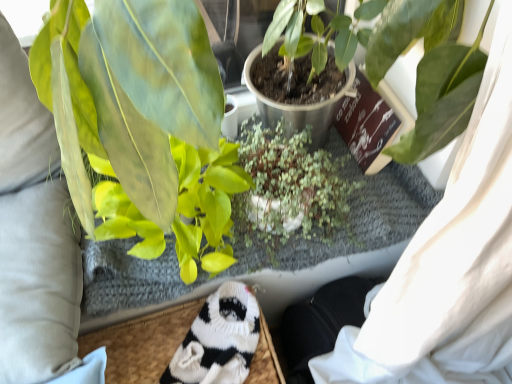
Question: Does green matte leafy plant at left, the second houseplant positioned from the back, appear on the right side of green matte plant at center, positioned as the third houseplant in front-to-back order?

Choices:
 (A) yes
 (B) no

Answer: (B)

Question: Considering the relative sizes of green matte leafy plant at left, the second houseplant positioned from the back, and green matte plant at center, which is the 1th houseplant in back-to-front order, in the image provided, is green matte leafy plant at left, the second houseplant positioned from the back, smaller than green matte plant at center, which is the 1th houseplant in back-to-front order,?

Choices:
 (A) no
 (B) yes

Answer: (A)

Question: Is green matte leafy plant at left, the second houseplant positioned from the back, oriented away from green matte plant at center, positioned as the third houseplant in front-to-back order?

Choices:
 (A) yes
 (B) no

Answer: (B)

Question: Considering the relative sizes of green matte leafy plant at left, the second houseplant positioned from the back, and green matte plant at center, positioned as the third houseplant in front-to-back order, in the image provided, is green matte leafy plant at left, the second houseplant positioned from the back, wider than green matte plant at center, positioned as the third houseplant in front-to-back order,?

Choices:
 (A) no
 (B) yes

Answer: (B)

Question: From a real-world perspective, is green matte leafy plant at left, which ranks as the second houseplant in front-to-back order, positioned under green matte plant at center, positioned as the third houseplant in front-to-back order, based on gravity?

Choices:
 (A) yes
 (B) no

Answer: (B)

Question: From the image's perspective, is green matte plant at center, positioned as the third houseplant in front-to-back order, located above or below green matte plant at center, the 1th houseplant when ordered from front to back?

Choices:
 (A) above
 (B) below

Answer: (B)

Question: In the image, is green matte plant at center, positioned as the third houseplant in front-to-back order, positioned in front of or behind green matte plant at center, positioned as the 3th houseplant in back-to-front order?

Choices:
 (A) front
 (B) behind

Answer: (B)

Question: Considering the positions of point (324, 175) and point (74, 28), is point (324, 175) closer or farther from the camera than point (74, 28)?

Choices:
 (A) closer
 (B) farther

Answer: (B)

Question: Do you think green matte plant at center, which is the 1th houseplant in back-to-front order, is within green matte plant at center, positioned as the 3th houseplant in back-to-front order, or outside of it?

Choices:
 (A) outside
 (B) inside

Answer: (B)

Question: Looking at their shapes, would you say green matte plant at center, positioned as the third houseplant in front-to-back order, is wider or thinner than green matte leafy plant at left, the second houseplant positioned from the back?

Choices:
 (A) wide
 (B) thin

Answer: (B)

Question: Considering their positions, is green matte plant at center, which is the 1th houseplant in back-to-front order, located in front of or behind green matte leafy plant at left, which ranks as the second houseplant in front-to-back order?

Choices:
 (A) behind
 (B) front

Answer: (A)

Question: Does point (258, 195) appear closer or farther from the camera than point (175, 54)?

Choices:
 (A) closer
 (B) farther

Answer: (B)

Question: Visually, is green matte plant at center, positioned as the third houseplant in front-to-back order, positioned to the left or to the right of green matte leafy plant at left, which ranks as the second houseplant in front-to-back order?

Choices:
 (A) right
 (B) left

Answer: (A)

Question: Is green matte plant at center, positioned as the 3th houseplant in back-to-front order, bigger or smaller than white knitted socks at lower center?

Choices:
 (A) small
 (B) big

Answer: (B)

Question: Is green matte plant at center, positioned as the 3th houseplant in back-to-front order, spatially inside white knitted socks at lower center, or outside of it?

Choices:
 (A) inside
 (B) outside

Answer: (B)